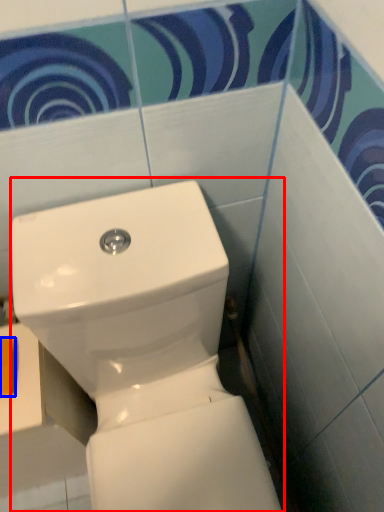
Question: Among these objects, which one is nearest to the camera, toilet (highlighted by a red box) or toilet paper (highlighted by a blue box)?

Choices:
 (A) toilet
 (B) toilet paper

Answer: (A)